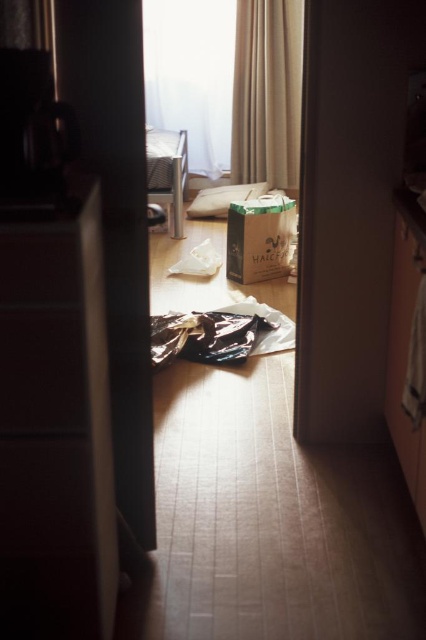
Is transparent fabric at upper center positioned in front of white paper bag at center?

No, transparent fabric at upper center is further to the viewer.

This screenshot has height=640, width=426. What do you see at coordinates (192, 76) in the screenshot?
I see `transparent fabric at upper center` at bounding box center [192, 76].

Locate an element on the screen. Image resolution: width=426 pixels, height=640 pixels. transparent fabric at upper center is located at coordinates (192, 76).

The image size is (426, 640). In order to click on transparent fabric at upper center in this screenshot , I will do `click(192, 76)`.

Does beige fabric curtain at upper center have a greater width compared to matte black drawer at left?

Yes.

Does beige fabric curtain at upper center have a smaller size compared to matte black drawer at left?

No.

Describe the element at coordinates (267, 92) in the screenshot. I see `beige fabric curtain at upper center` at that location.

Image resolution: width=426 pixels, height=640 pixels. I want to click on beige fabric curtain at upper center, so click(x=267, y=92).

Looking at this image, can you confirm if transparent fabric at upper center is positioned above matte black drawer at left?

Yes, transparent fabric at upper center is above matte black drawer at left.

Does point (186, 81) come in front of point (85, 397)?

No, (186, 81) is further to viewer.

You are a GUI agent. You are given a task and a screenshot of the screen. Output one action in this format:
    pyautogui.click(x=<x>, y=<y>)
    Task: Click on the transparent fabric at upper center
    The height and width of the screenshot is (640, 426).
    Given the screenshot: What is the action you would take?
    pyautogui.click(x=192, y=76)